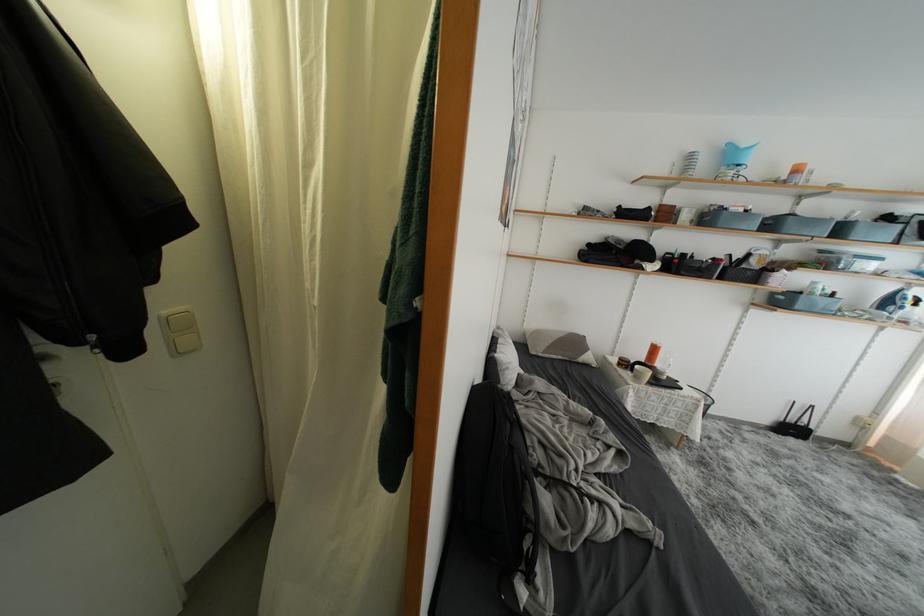
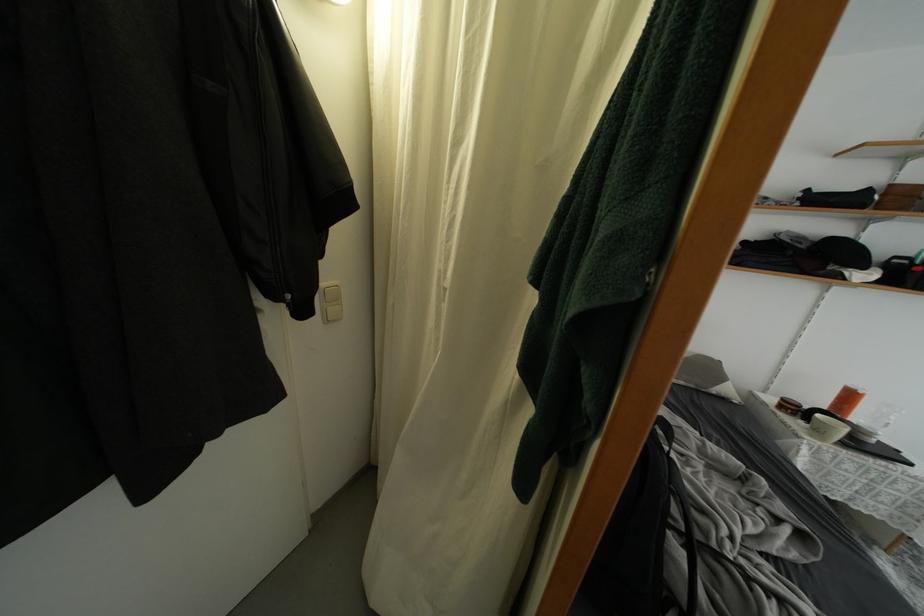
Locate, in the second image, the point that corresponds to point 152,323 in the first image.

(323, 291)